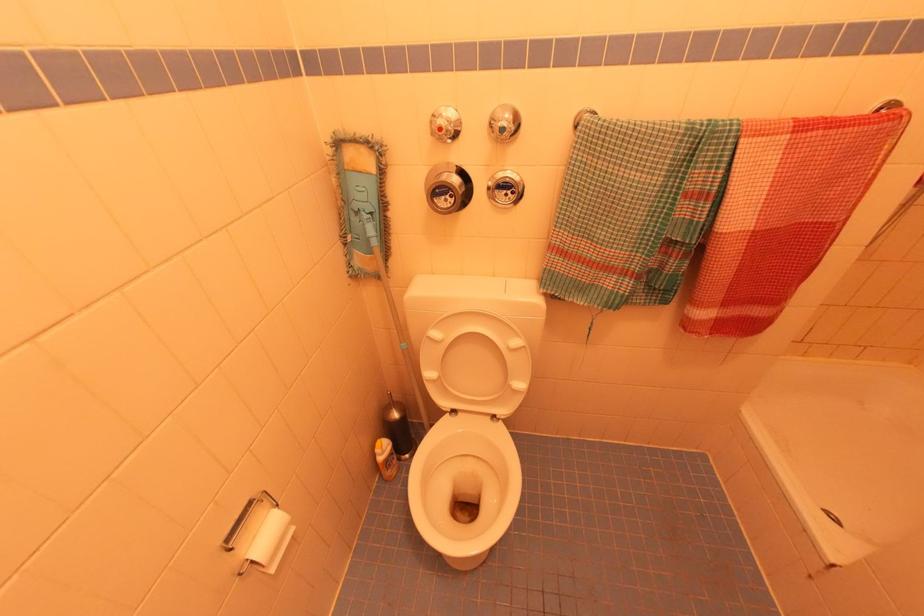
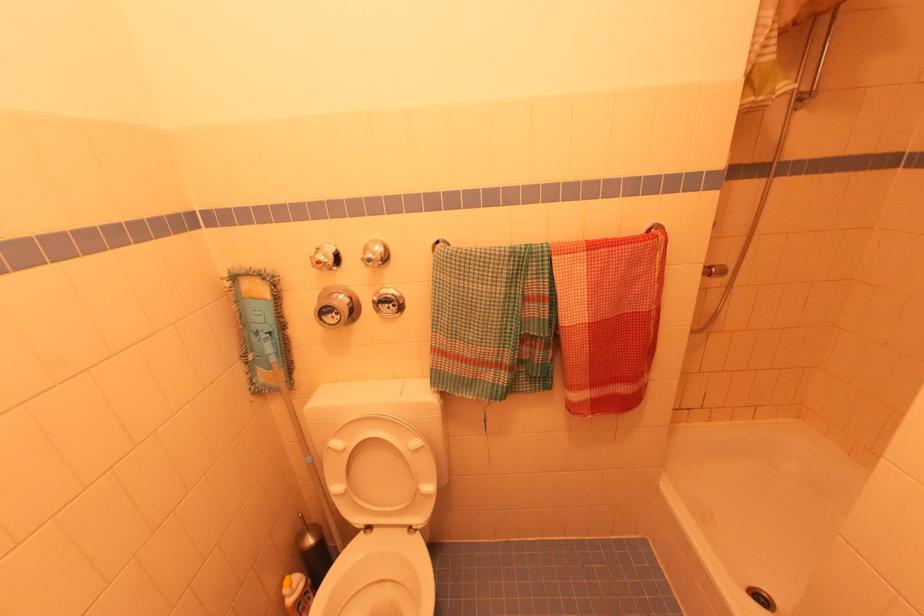
In the second image, find the point that corresponds to point 385,448 in the first image.

(296, 585)